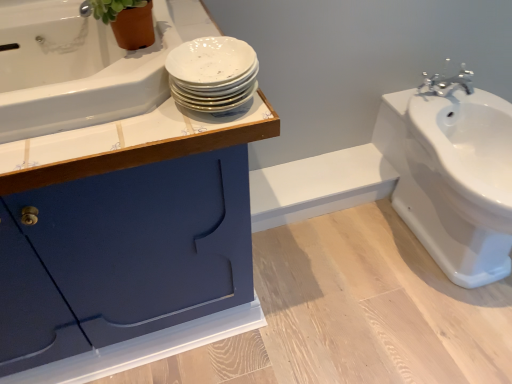
Question: In the image, is green matte plant at upper left on the left side or the right side of white glossy bathtub at upper left?

Choices:
 (A) left
 (B) right

Answer: (B)

Question: From a real-world perspective, relative to white glossy bathtub at upper left, is green matte plant at upper left vertically above or below?

Choices:
 (A) below
 (B) above

Answer: (B)

Question: Estimate the real-world distances between objects in this image. Which object is closer to the matte blue cabinet at upper left?

Choices:
 (A) white glossy sink at right
 (B) green matte plant at upper left
 (C) white glossy plates at upper center
 (D) white glossy bathtub at upper left

Answer: (D)

Question: Estimate the real-world distances between objects in this image. Which object is closer to the white glossy sink at right?

Choices:
 (A) green matte plant at upper left
 (B) white glossy plates at upper center
 (C) white glossy bathtub at upper left
 (D) matte blue cabinet at upper left

Answer: (D)